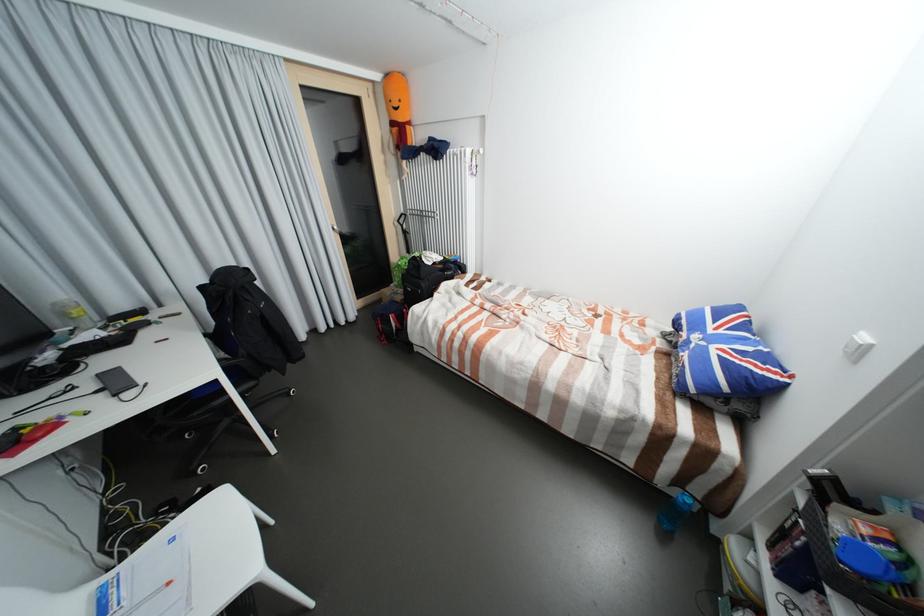
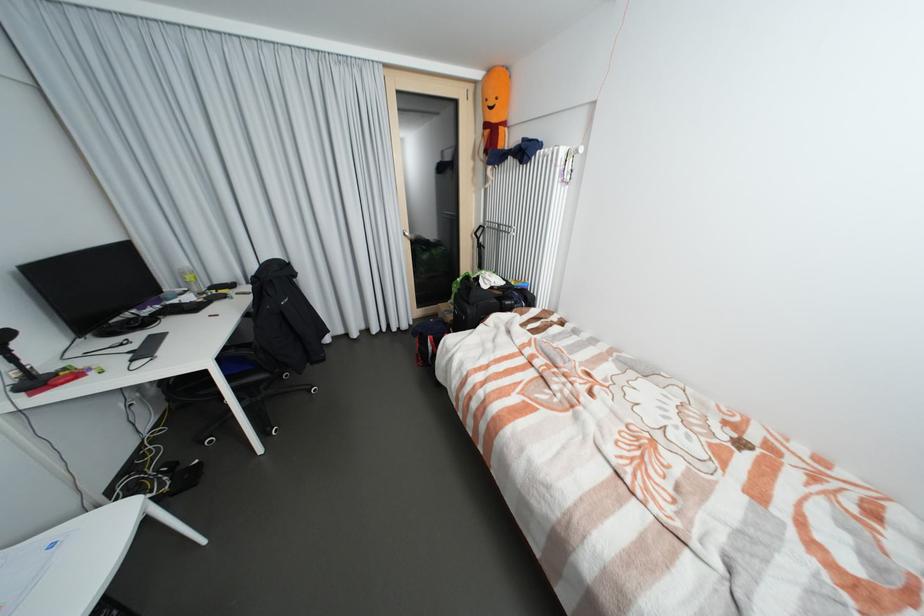
In the second image, find the point that corresponds to (82,313) in the first image.

(197, 278)